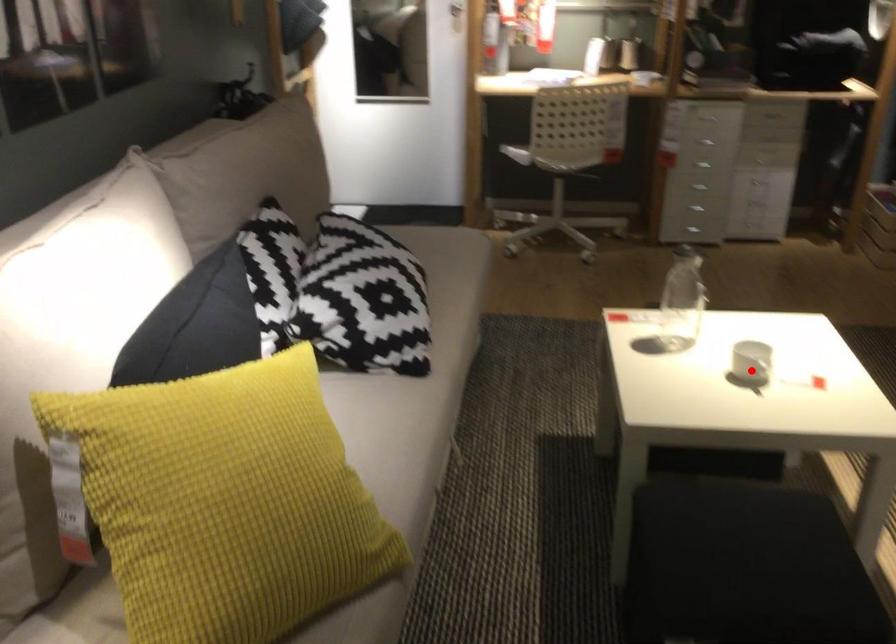
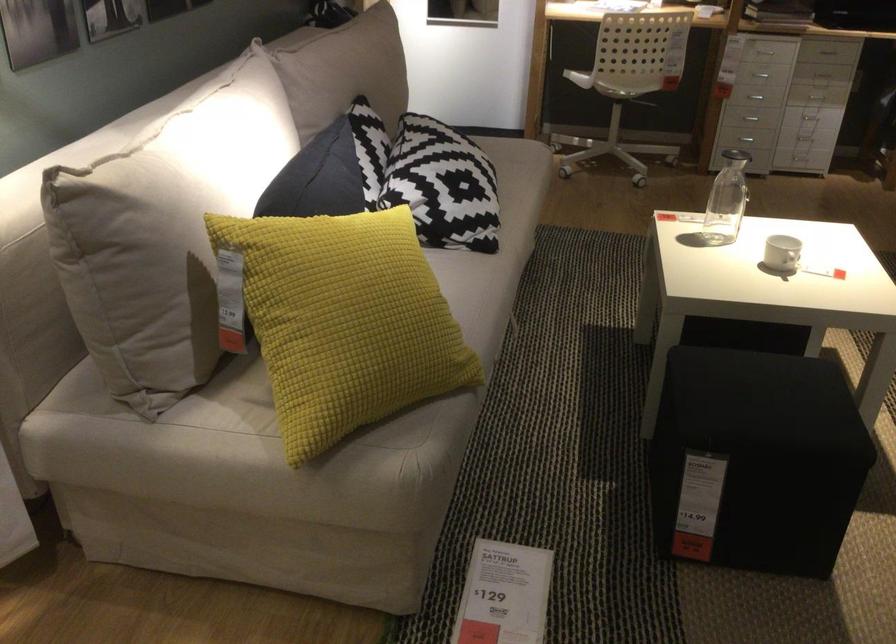
Locate, in the second image, the point that corresponds to the highlighted location in the first image.

(781, 252)